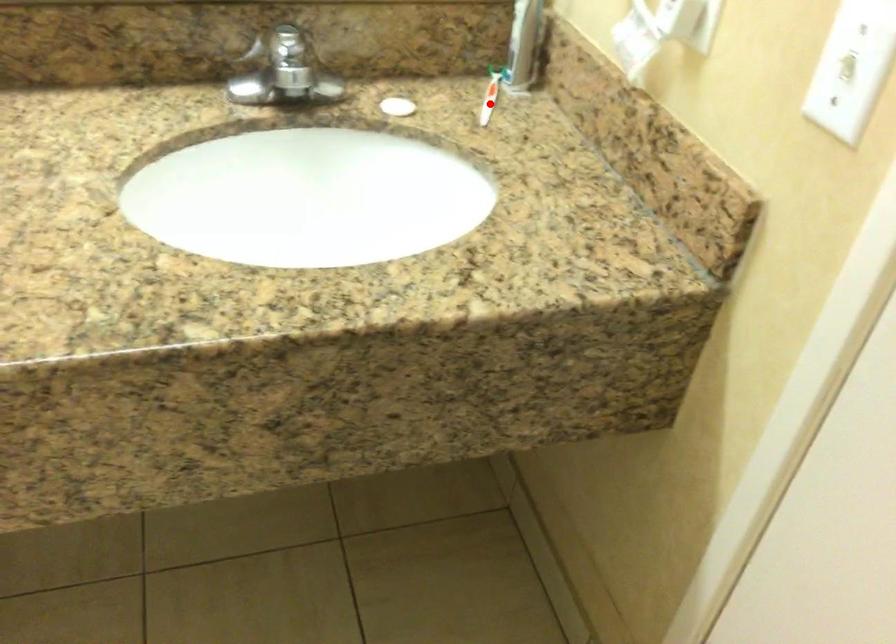
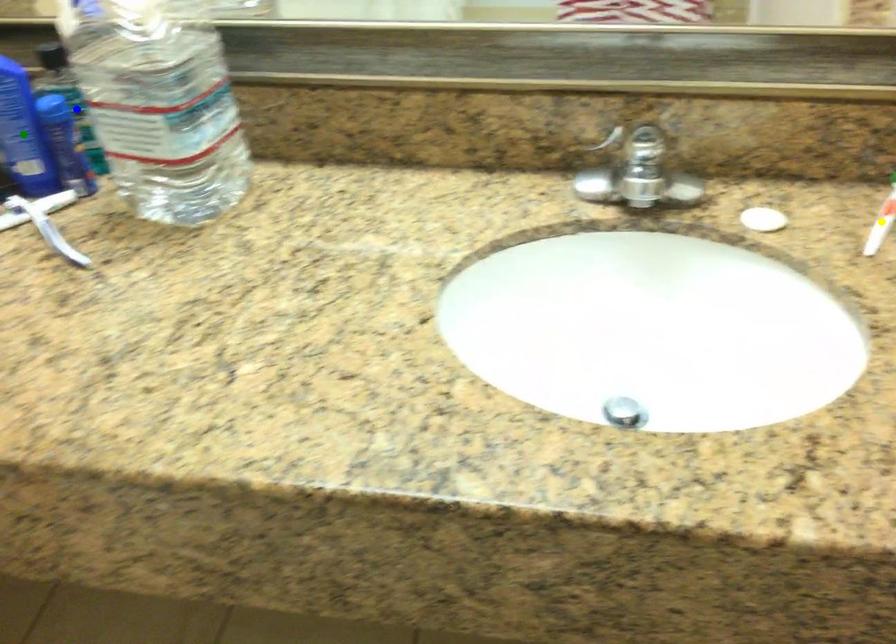
Question: I am providing you with two images of the same scene from different viewpoints. A red point is marked on the first image. You are given multiple points on the second image. Which mark in image 2 goes with the point in image 1?

Choices:
 (A) yellow point
 (B) green point
 (C) blue point

Answer: (A)